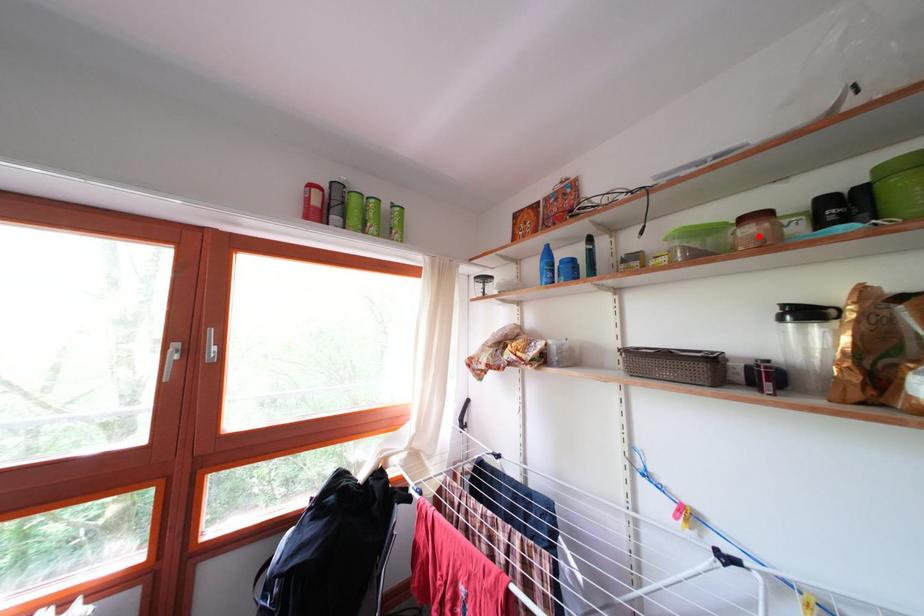
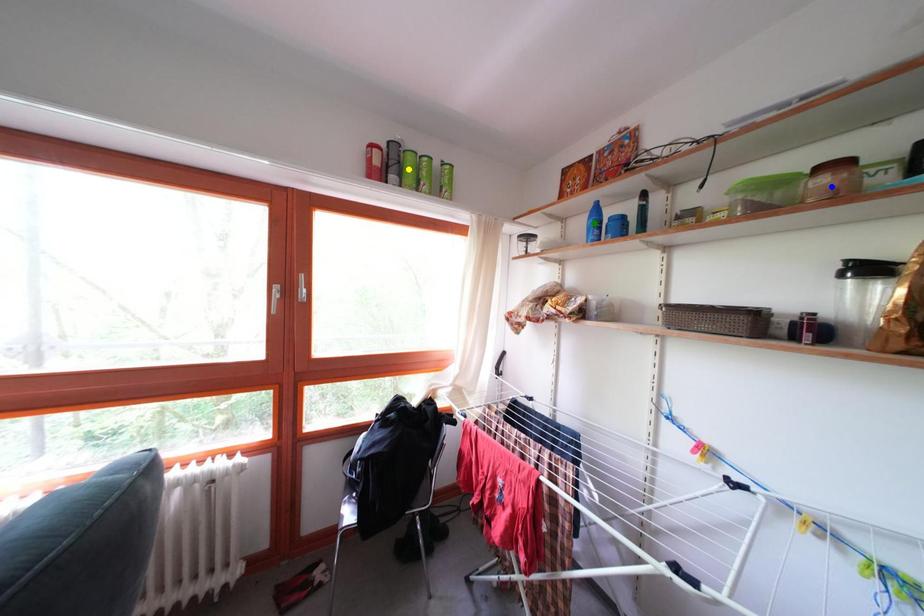
Question: I am providing you with two images of the same scene from different viewpoints. A red point is marked on the first image. You are given multiple points on the second image. Which spot in image 2 lines up with the point in image 1?

Choices:
 (A) blue point
 (B) yellow point
 (C) green point

Answer: (A)